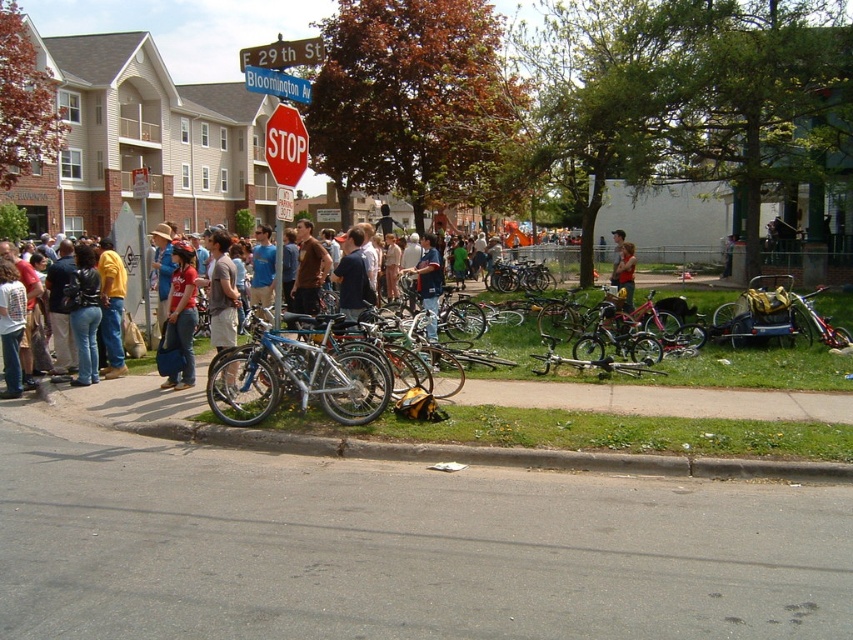
Which is more to the right, red matte stop sign at center or red plastic stop sign at upper center?

From the viewer's perspective, red matte stop sign at center appears more on the right side.

Who is taller, red matte stop sign at center or red plastic stop sign at upper center?

Standing taller between the two is red plastic stop sign at upper center.

Does point (268, 156) come farther from viewer compared to point (314, 38)?

No, (268, 156) is in front of (314, 38).

Image resolution: width=853 pixels, height=640 pixels. What are the coordinates of `red matte stop sign at center` in the screenshot? It's located at (285, 145).

In the scene shown: Which of these two, gray concrete curb at lower center or matte red shirt at center, stands taller?

Result: matte red shirt at center

Is gray concrete curb at lower center smaller than matte red shirt at center?

Yes, gray concrete curb at lower center is smaller than matte red shirt at center.

The width and height of the screenshot is (853, 640). What do you see at coordinates (491, 452) in the screenshot?
I see `gray concrete curb at lower center` at bounding box center [491, 452].

The width and height of the screenshot is (853, 640). Find the location of `gray concrete curb at lower center`. gray concrete curb at lower center is located at coordinates (491, 452).

Is red stop sign at upper center positioned at the back of matte blue shirt at center?

No, red stop sign at upper center is in front of matte blue shirt at center.

Is red stop sign at upper center wider than matte blue shirt at center?

Indeed, red stop sign at upper center has a greater width compared to matte blue shirt at center.

Is point (294, 80) in front of point (630, 308)?

Yes, it is.

Find the location of a particular element. red stop sign at upper center is located at coordinates (277, 83).